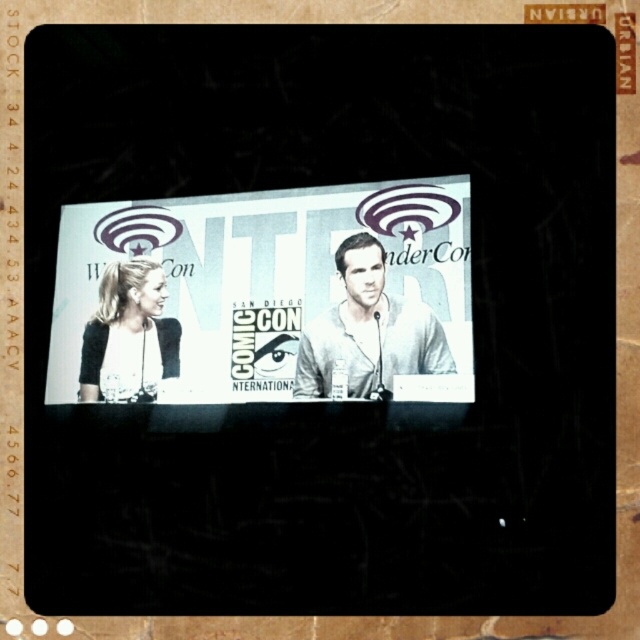
Question: Which object appears closest to the camera in this image?

Choices:
 (A) white paper poster at center
 (B) light gray shirt at center

Answer: (A)

Question: Among these objects, which one is farthest from the camera?

Choices:
 (A) white paper poster at center
 (B) light gray shirt at center

Answer: (B)

Question: Is white paper poster at center bigger than light gray shirt at center?

Choices:
 (A) yes
 (B) no

Answer: (A)

Question: Which point is farther to the camera?

Choices:
 (A) (300, 356)
 (B) (348, 301)

Answer: (B)

Question: Can you confirm if white paper poster at center is wider than light gray shirt at center?

Choices:
 (A) yes
 (B) no

Answer: (A)

Question: Can you confirm if white paper poster at center is positioned above light gray shirt at center?

Choices:
 (A) no
 (B) yes

Answer: (B)